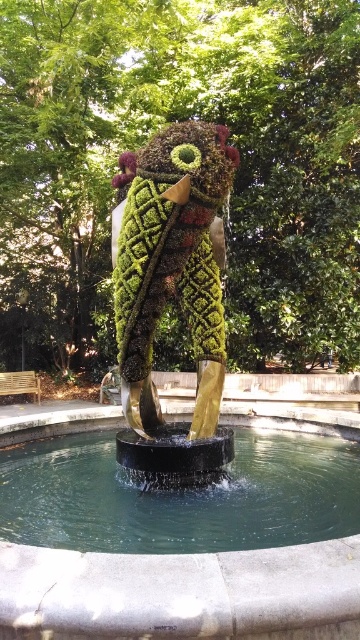
Question: Which point is closer to the camera taking this photo?

Choices:
 (A) (289, 525)
 (B) (185, 305)

Answer: (A)

Question: Does clear water at fountain center have a lesser width compared to green mossy sculpture at center?

Choices:
 (A) yes
 (B) no

Answer: (B)

Question: Is clear water at fountain center wider than green mossy sculpture at center?

Choices:
 (A) no
 (B) yes

Answer: (B)

Question: Which of the following is the farthest from the observer?

Choices:
 (A) (123, 241)
 (B) (6, 449)

Answer: (B)

Question: Can you confirm if clear water at fountain center is bigger than green mossy sculpture at center?

Choices:
 (A) yes
 (B) no

Answer: (B)